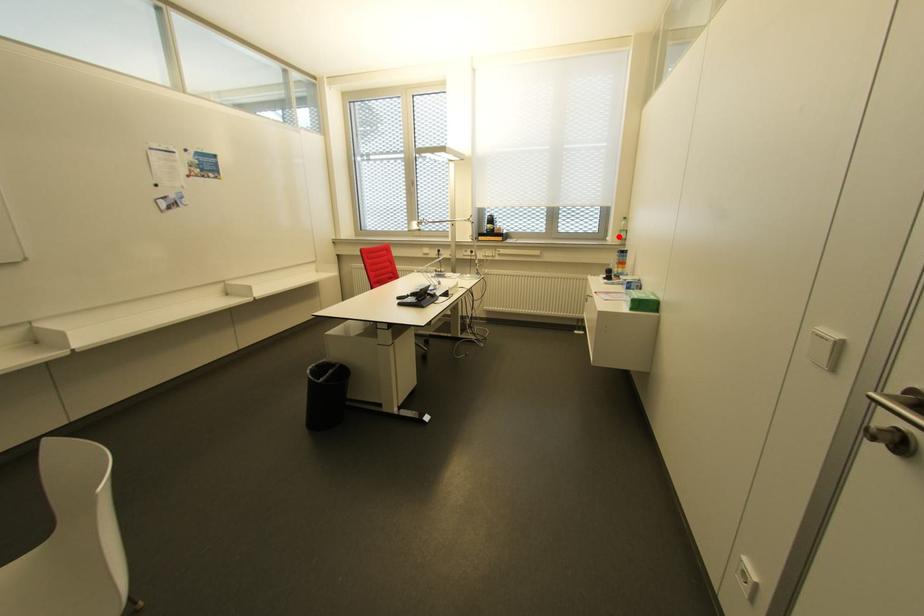
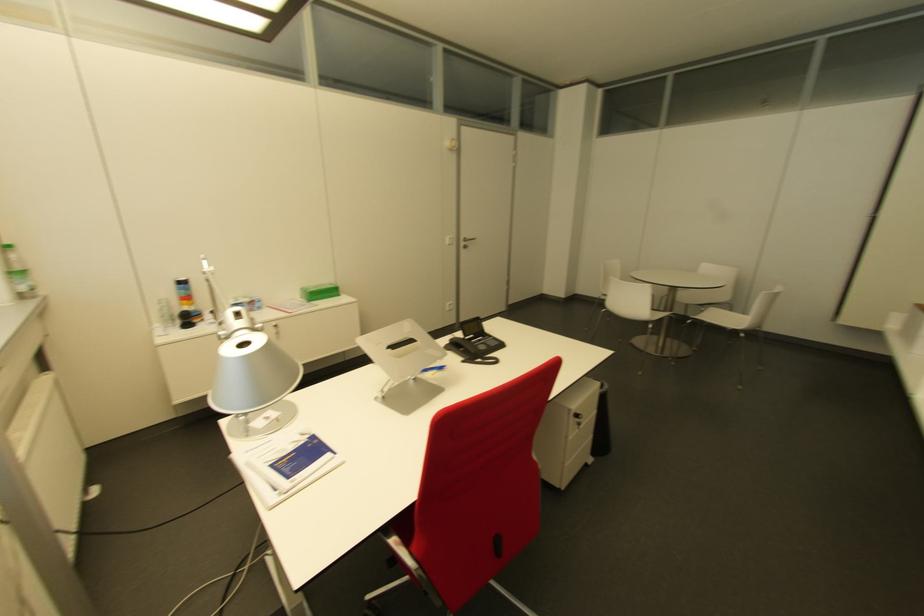
Question: I am providing you with two images of the same scene from different viewpoints. Image1 has a red point marked. In image2, the corresponding 3D location appears at what relative position? Reply with the corresponding letter.

Choices:
 (A) Closer
 (B) Farther

Answer: (B)